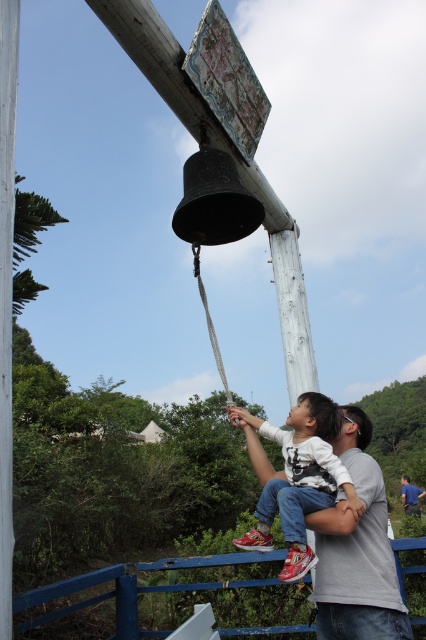
Between gray cotton shirt at center and white cotton shirt at center, which one has less height?

gray cotton shirt at center is shorter.

Who is taller, gray cotton shirt at center or white cotton shirt at center?

white cotton shirt at center is taller.

This screenshot has width=426, height=640. Identify the location of gray cotton shirt at center. (356, 550).

What are the coordinates of `gray cotton shirt at center` in the screenshot? It's located at (356, 550).

Is gray cotton shirt at center to the right of gray fabric shirt at upper center from the viewer's perspective?

No, gray cotton shirt at center is not to the right of gray fabric shirt at upper center.

Locate an element on the screen. This screenshot has height=640, width=426. gray cotton shirt at center is located at coordinates (356, 550).

Image resolution: width=426 pixels, height=640 pixels. I want to click on gray cotton shirt at center, so click(356, 550).

Can you confirm if white cotton shirt at center is wider than gray fabric shirt at upper center?

Yes.

Who is positioned more to the left, white cotton shirt at center or gray fabric shirt at upper center?

From the viewer's perspective, white cotton shirt at center appears more on the left side.

Who is more distant from viewer, (302, 449) or (411, 506)?

Positioned behind is point (411, 506).

I want to click on white cotton shirt at center, so click(x=299, y=480).